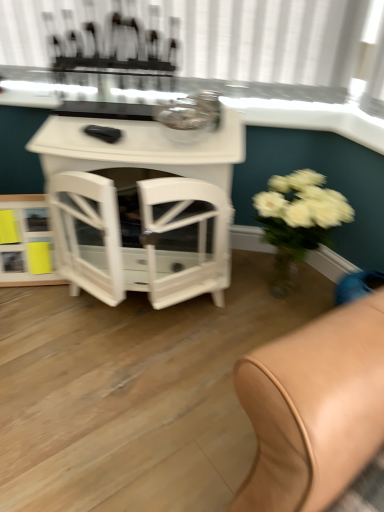
Find the location of a particular element. free space in front of white glossy shelf at lower left is located at coordinates point(35,306).